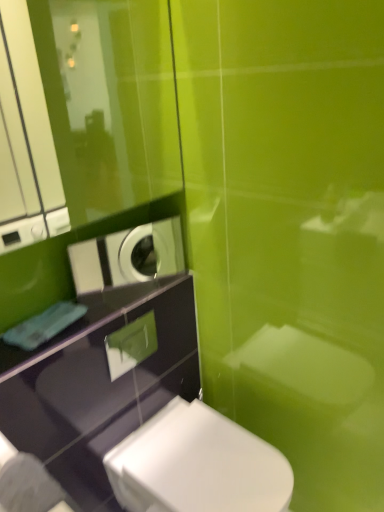
Find the location of `free space above white glossy toilet at lower center (from a real-world perspective)`. free space above white glossy toilet at lower center (from a real-world perspective) is located at coordinates click(x=209, y=455).